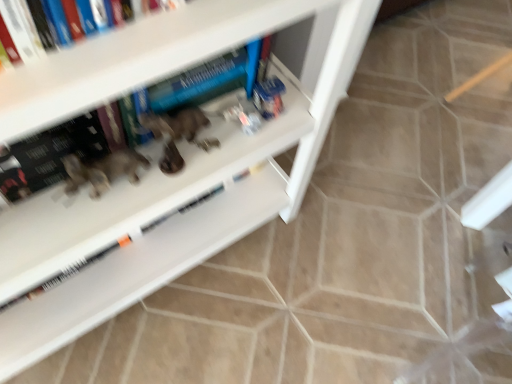
What do you see at coordinates (269, 97) in the screenshot? I see `metallic blue toy at center` at bounding box center [269, 97].

In order to face metallic blue toy at center, should I rotate leftwards or rightwards?

You should rotate right by 1.966 degrees.

This screenshot has width=512, height=384. Find the location of `metallic blue toy at center`. metallic blue toy at center is located at coordinates (269, 97).

Locate an element on the screen. The image size is (512, 384). metallic blue toy at center is located at coordinates (269, 97).